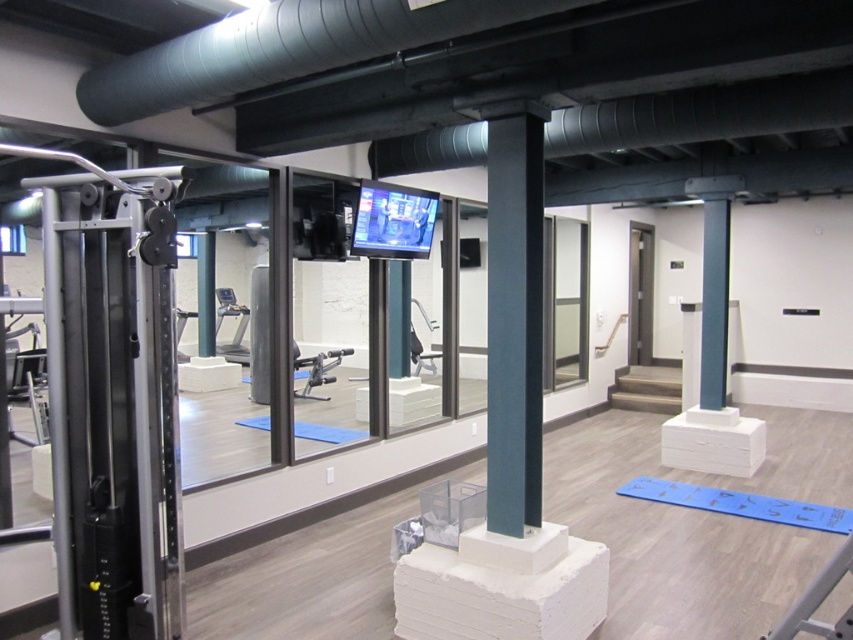
You are a fitness instructor planning to set up a new exercise station in the gym. You want to place a yoga mat exactly 0.3 units to the right of the satin dark green pole at center. What are the coordinates of the yoga mat?

The coordinates of the yoga mat would be calculated by adding 0.3 to the x coordinate of the satin dark green pole at center. Since the pole is at point (514,323), the new coordinates would be 0.505 plus 0.3 equals 0.805 for the x coordinate, and the y coordinate remains 0.604. Therefore, the yoga mat should be placed at point (514,515).

You are an athlete preparing for a competition and you see the satin dark green pole at center and the flat screen monitor at center in the gym. Which object would block your view of the monitor if you stand behind the pole?

The satin dark green pole at center is taller than the flat screen monitor at center, so standing behind the pole would block your view of the monitor since the pole extends higher.